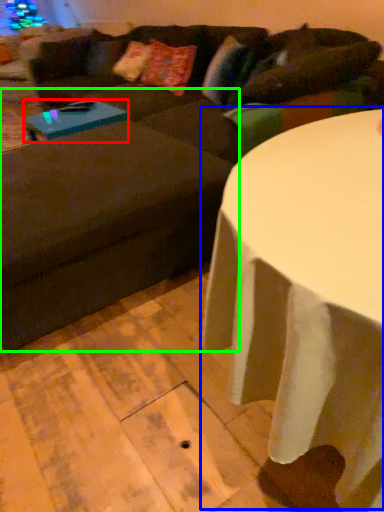
Question: Which object is positioned farthest from coffee table (highlighted by a red box)? Select from table (highlighted by a blue box) and swivel chair (highlighted by a green box).

Choices:
 (A) table
 (B) swivel chair

Answer: (A)